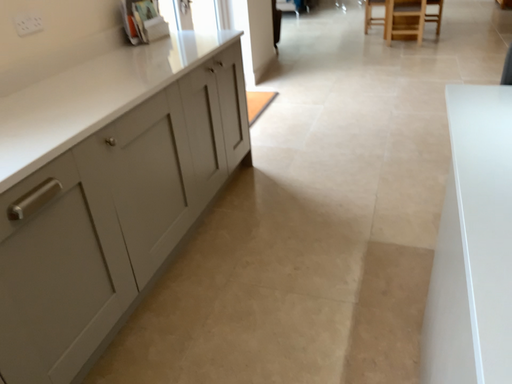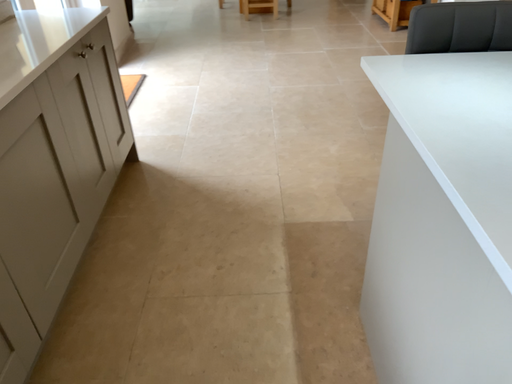
Question: Which way did the camera rotate in the video?

Choices:
 (A) rotated left
 (B) rotated right

Answer: (B)